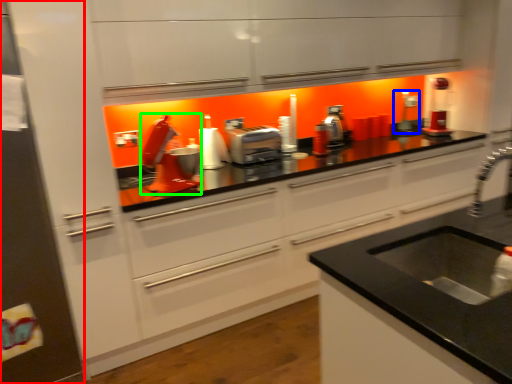
Question: Estimate the real-world distances between objects in this image. Which object is farther from fridge (highlighted by a red box), appliance (highlighted by a blue box) or appliance (highlighted by a green box)?

Choices:
 (A) appliance
 (B) appliance

Answer: (A)